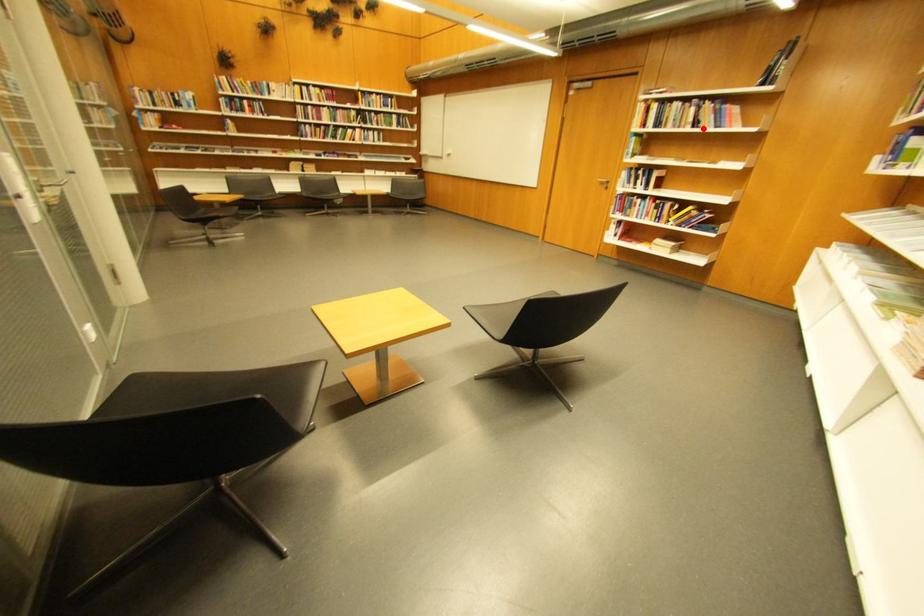
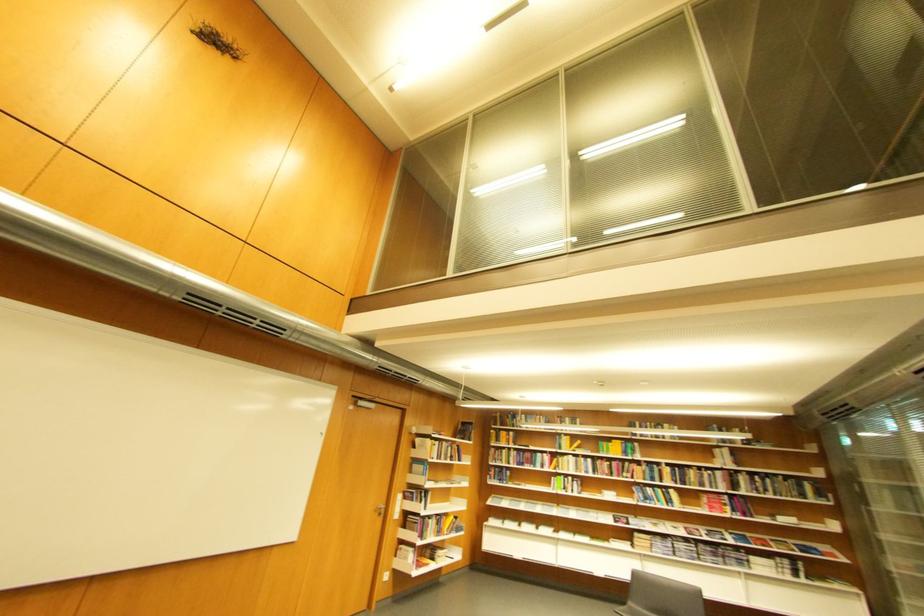
Question: I am providing you with two images of the same scene from different viewpoints. In image1, a red point is highlighted. Considering the same 3D point in image2, which of the following is correct?

Choices:
 (A) It is closer
 (B) It is farther

Answer: (B)